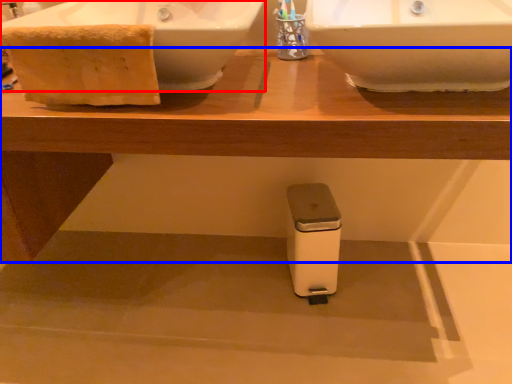
Question: Which object is closer to the camera taking this photo, sink (highlighted by a red box) or table (highlighted by a blue box)?

Choices:
 (A) sink
 (B) table

Answer: (B)